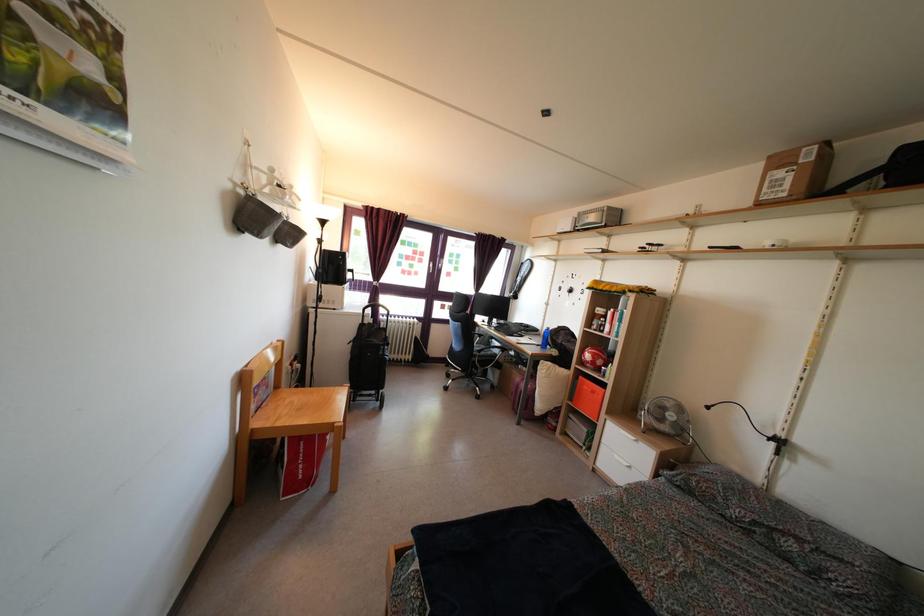
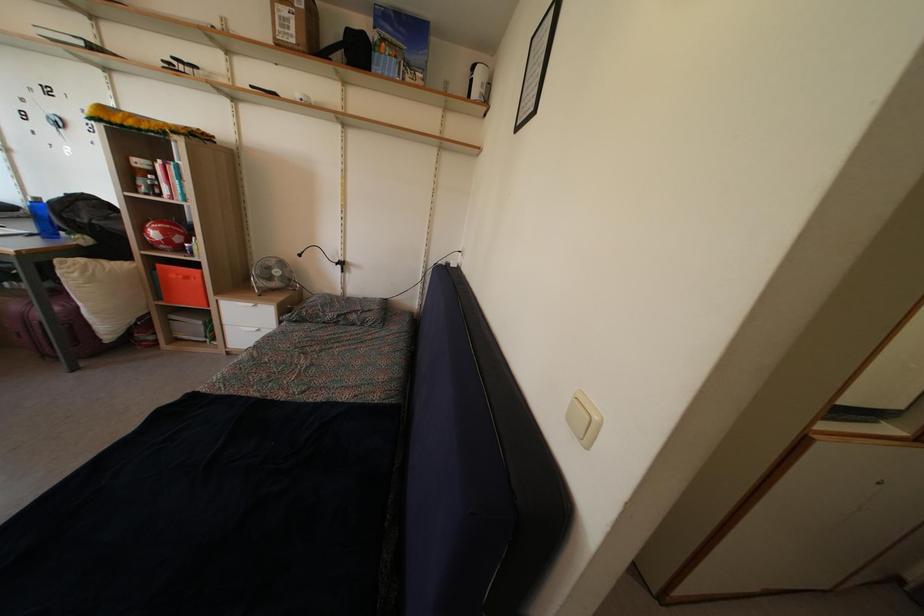
The point at (551,337) is marked in the first image. Where is the corresponding point in the second image?

(40, 208)